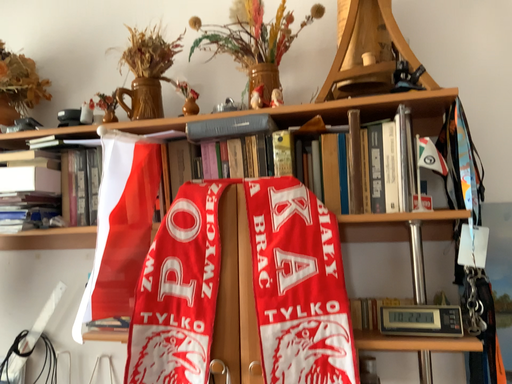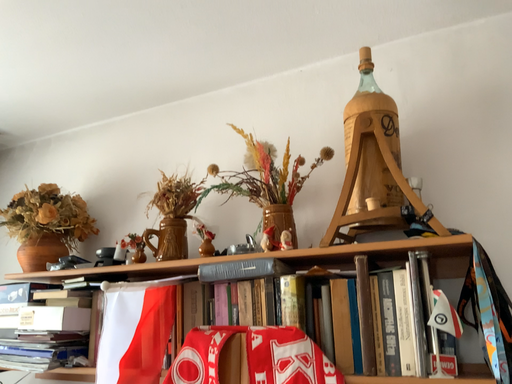
Question: How did the camera likely rotate when shooting the video?

Choices:
 (A) rotated downward
 (B) rotated upward

Answer: (B)